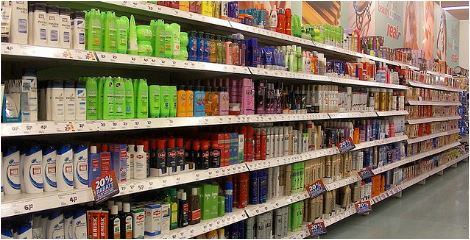
What are the coordinates of `top shelf` in the screenshot? It's located at (433, 72), (353, 53), (179, 11).